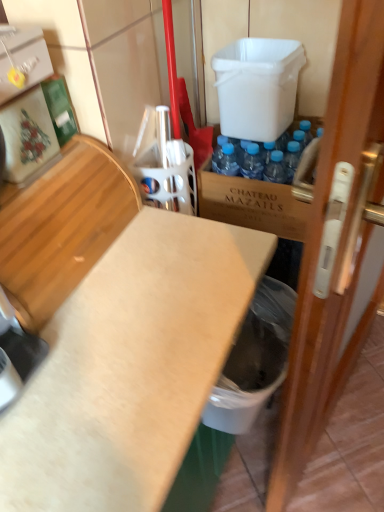
Question: Is white matte countertop at center facing towards light brown wood at left?

Choices:
 (A) yes
 (B) no

Answer: (B)

Question: Considering the relative sizes of white matte countertop at center and light brown wood at left in the image provided, is white matte countertop at center bigger than light brown wood at left?

Choices:
 (A) no
 (B) yes

Answer: (B)

Question: Does white matte countertop at center lie behind light brown wood at left?

Choices:
 (A) yes
 (B) no

Answer: (B)

Question: From a real-world perspective, is white matte countertop at center over light brown wood at left?

Choices:
 (A) yes
 (B) no

Answer: (B)

Question: Is white matte countertop at center taller than light brown wood at left?

Choices:
 (A) no
 (B) yes

Answer: (B)

Question: Is white matte countertop at center wider than light brown wood at left?

Choices:
 (A) yes
 (B) no

Answer: (A)

Question: From a real-world perspective, is brown wooden crate at center physically below wooden door at right?

Choices:
 (A) yes
 (B) no

Answer: (B)

Question: Considering the relative sizes of brown wooden crate at center and wooden door at right in the image provided, is brown wooden crate at center taller than wooden door at right?

Choices:
 (A) yes
 (B) no

Answer: (B)

Question: From a real-world perspective, is brown wooden crate at center positioned over wooden door at right based on gravity?

Choices:
 (A) yes
 (B) no

Answer: (A)

Question: Is brown wooden crate at center facing away from wooden door at right?

Choices:
 (A) yes
 (B) no

Answer: (B)

Question: Could you tell me if brown wooden crate at center is turned towards wooden door at right?

Choices:
 (A) no
 (B) yes

Answer: (A)

Question: Does brown wooden crate at center touch wooden door at right?

Choices:
 (A) no
 (B) yes

Answer: (A)

Question: From the image's perspective, is brown wooden crate at center located above white plastic trash can at lower right?

Choices:
 (A) yes
 (B) no

Answer: (A)